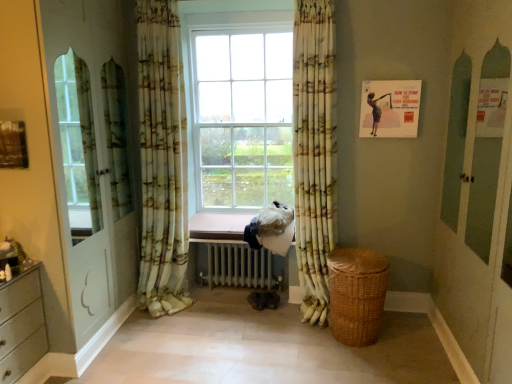
Where is `space that is in front of woven brown basket at lower right`? The width and height of the screenshot is (512, 384). space that is in front of woven brown basket at lower right is located at coordinates (369, 368).